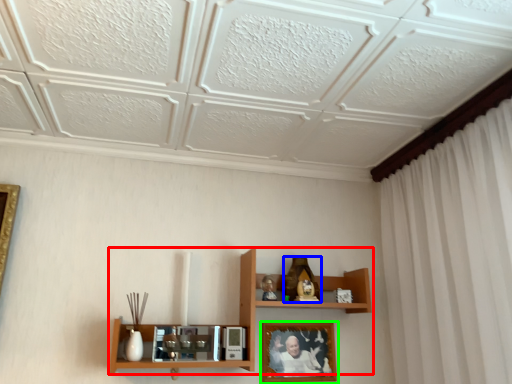
Question: Which is nearer to the shelf (highlighted by a red box)? toy (highlighted by a blue box) or picture frame (highlighted by a green box).

Choices:
 (A) toy
 (B) picture frame

Answer: (B)